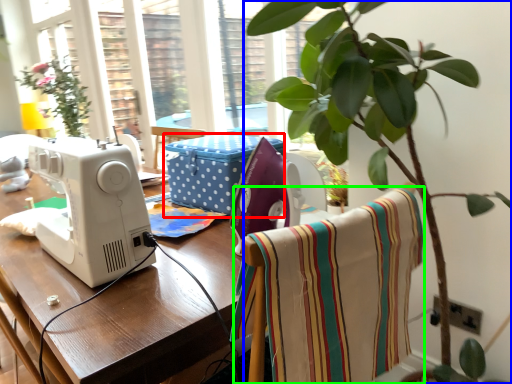
Question: Estimate the real-world distances between objects in this image. Which object is closer to box (highlighted by a red box), houseplant (highlighted by a blue box) or blanket (highlighted by a green box)?

Choices:
 (A) houseplant
 (B) blanket

Answer: (A)